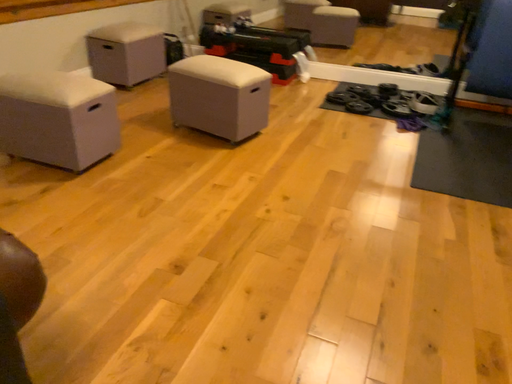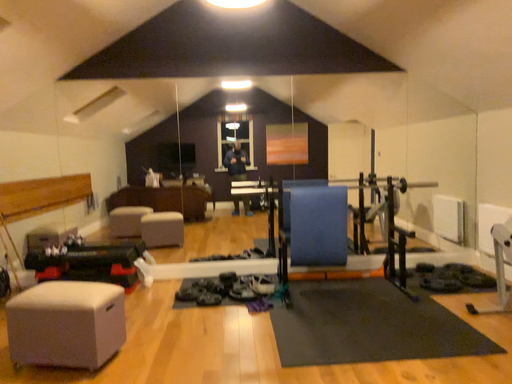
Question: Which way did the camera rotate in the video?

Choices:
 (A) rotated downward
 (B) rotated upward

Answer: (B)